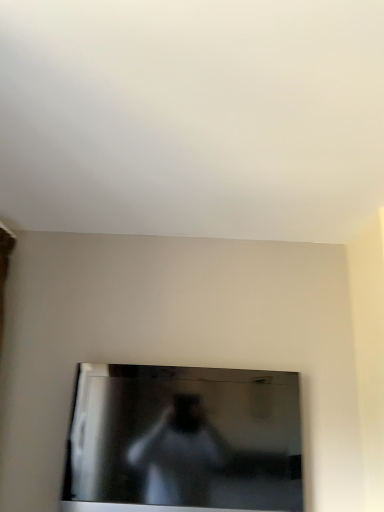
Describe the element at coordinates (185, 438) in the screenshot. I see `black glossy tv at center` at that location.

Locate an element on the screen. black glossy tv at center is located at coordinates tap(185, 438).

Where is `black glossy tv at center`? The width and height of the screenshot is (384, 512). black glossy tv at center is located at coordinates (185, 438).